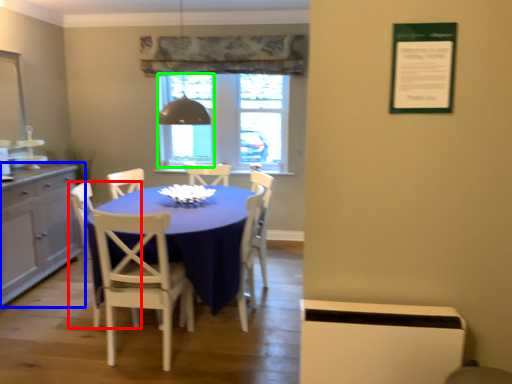
Question: Considering the real-world distances, which object is closest to chair (highlighted by a red box)? cabinetry (highlighted by a blue box) or window screen (highlighted by a green box).

Choices:
 (A) cabinetry
 (B) window screen

Answer: (A)